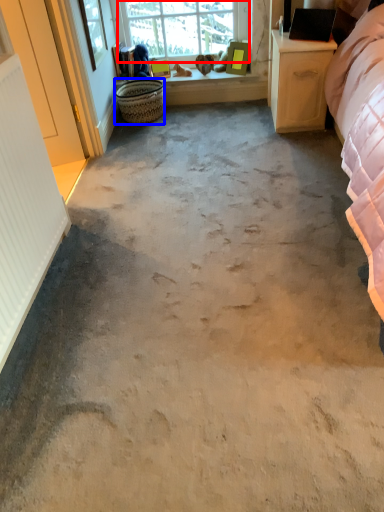
Question: Among these objects, which one is farthest to the camera, window (highlighted by a red box) or basket (highlighted by a blue box)?

Choices:
 (A) window
 (B) basket

Answer: (A)